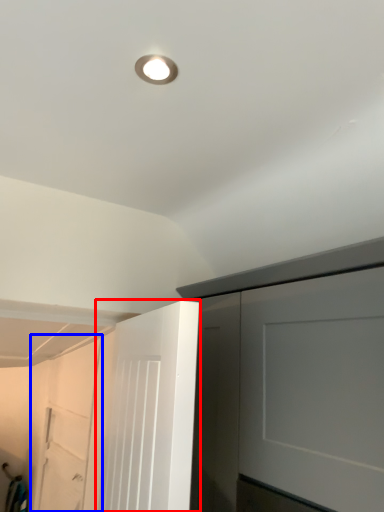
Question: Which of the following is the farthest to the observer, door (highlighted by a red box) or garage door (highlighted by a blue box)?

Choices:
 (A) door
 (B) garage door

Answer: (B)